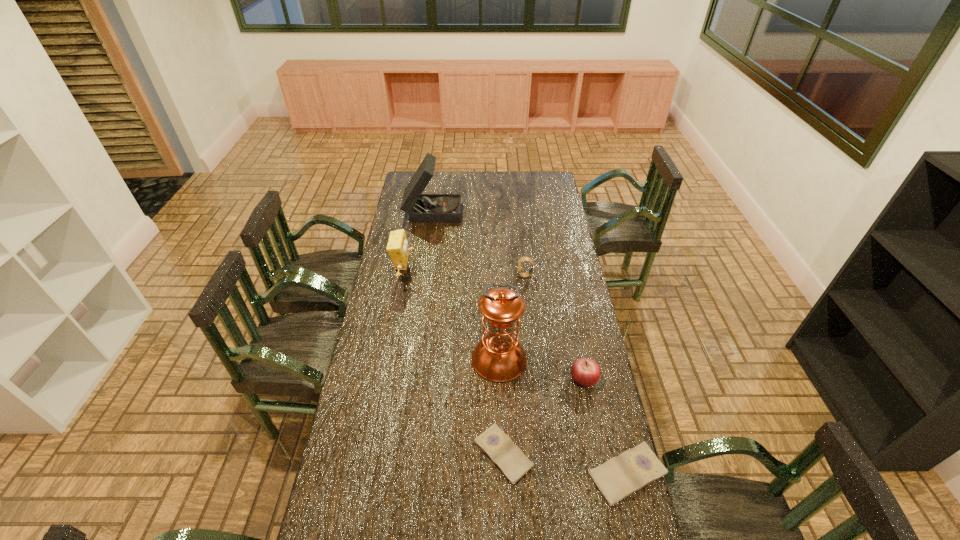
Please point a spot on the left to add another diary. Please provide its 2D coordinates. Your answer should be formatted as a tuple, i.e. [(x, y)], where the tuple contains the x and y coordinates of a point satisfying the conditions above.

[(387, 435)]